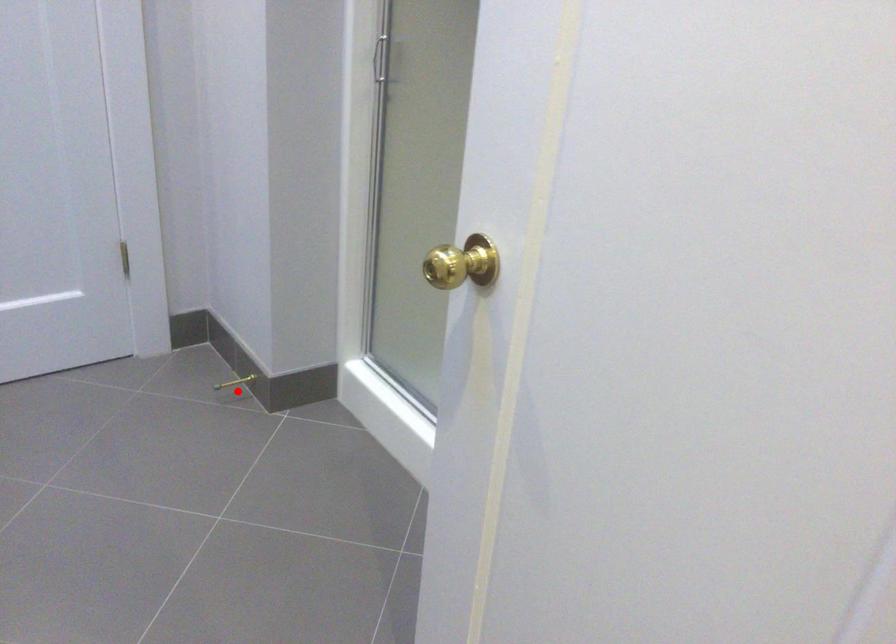
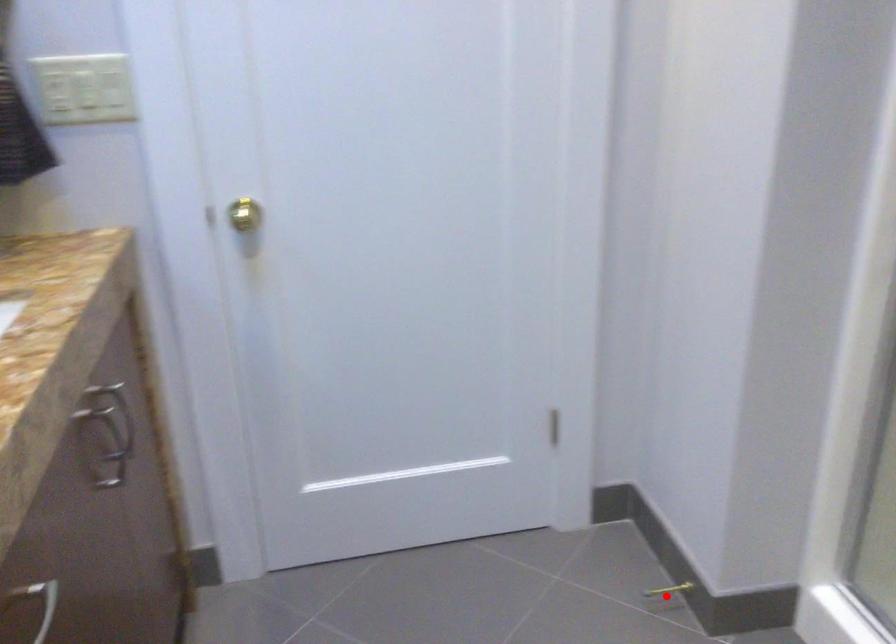
I am providing you with two images of the same scene from different viewpoints. A red point is marked on the first image and another point is marked on the second image. Are the points marked in image1 and image2 representing the same 3D position?

Yes